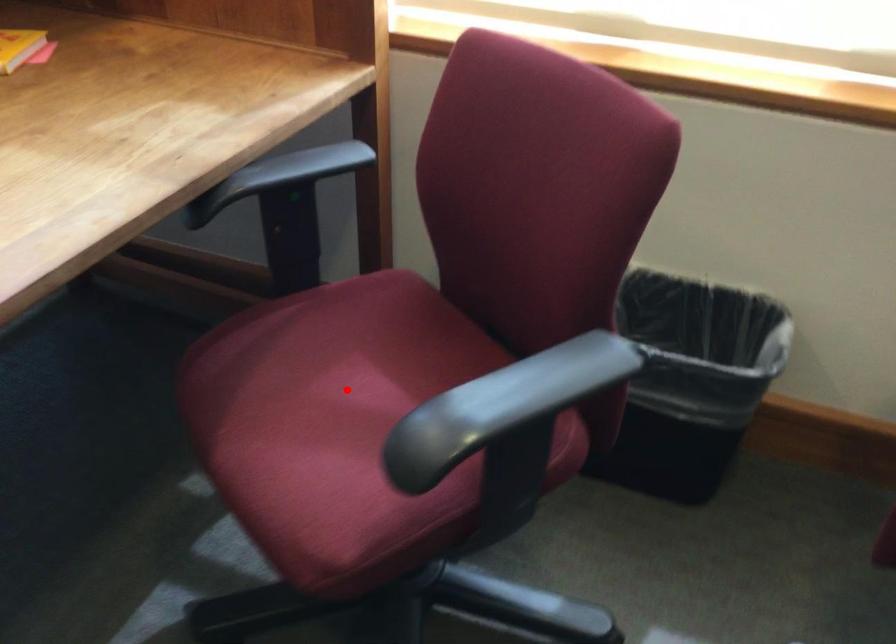
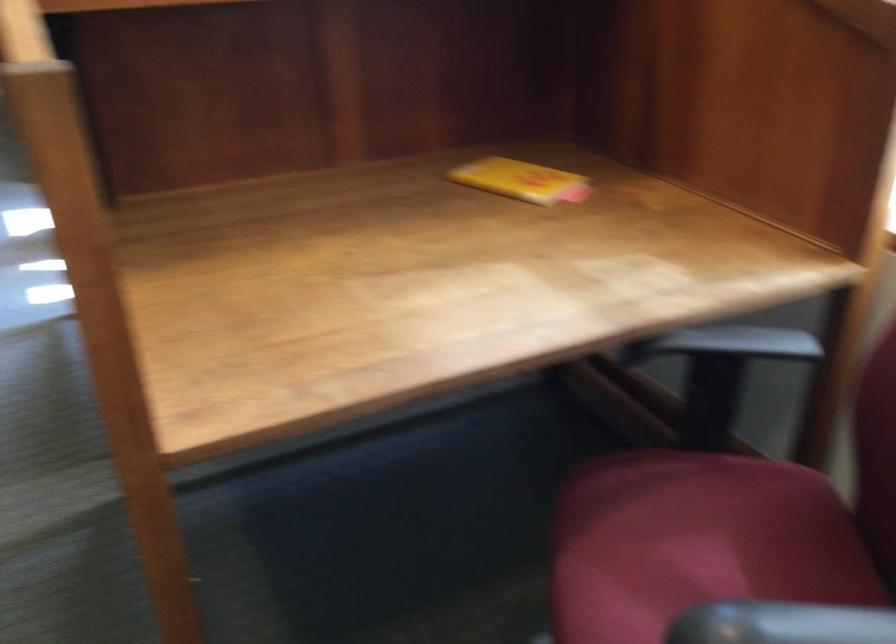
Find the pixel in the second image that matches the highlighted location in the first image.

(694, 554)